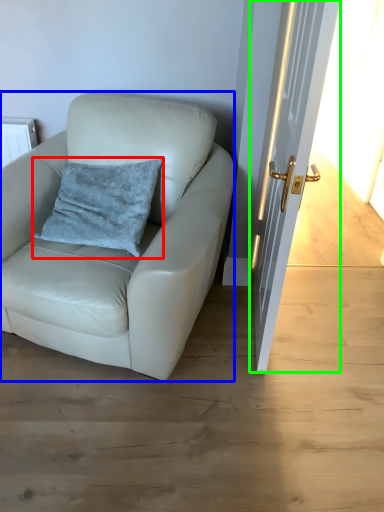
Question: Which is nearer to the pillow (highlighted by a red box)? chair (highlighted by a blue box) or door (highlighted by a green box).

Choices:
 (A) chair
 (B) door

Answer: (A)